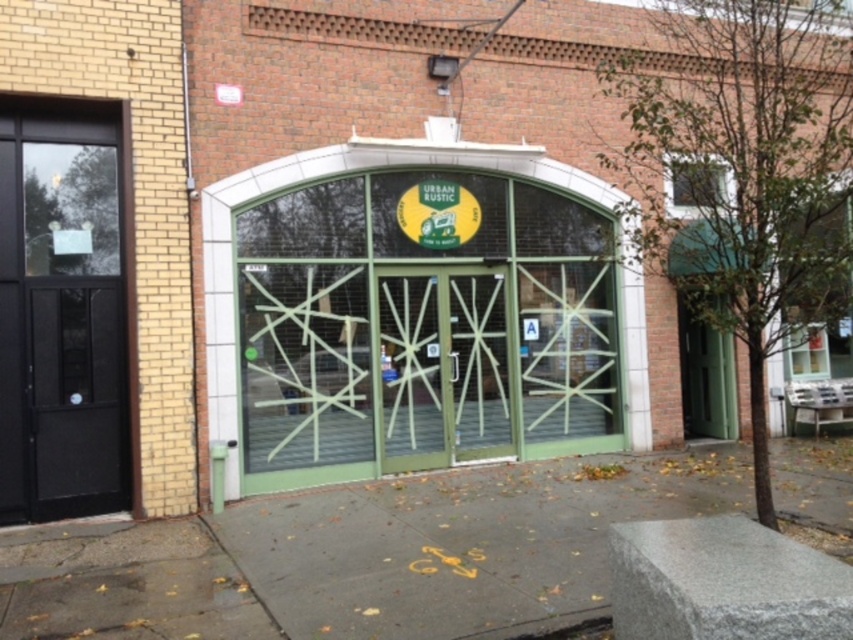
You are a delivery person approaching the entrance of the building. You need to place a package on the gray concrete sidewalk at center before entering through the green matte door at center. Can you confirm if the sidewalk is accessible before the door?

The gray concrete sidewalk at center is in front of the green matte door at center, so yes, the sidewalk is accessible before the door.

You are a delivery person with a large cart that is 2 meters wide. You need to move from the gray concrete sidewalk at center to the green matte door at right. Can your cart fit through the space between them?

The gray concrete sidewalk at center has a width less than the green matte door at right, so the cart that is 2 meters wide may not fit through the space between them if the sidewalk is narrower than the door. However, the exact dimensions are not provided, so it is uncertain.

You are standing at the entrance of the building and see two points marked on the ground. The first point is at coordinate point (305,612) and the second is at point (439,308). If you want to walk towards the point that is closer to you, which coordinate should you head towards?

You should head towards point (305,612) because it is in front of point (439,308), meaning it is closer to your current position at the entrance.